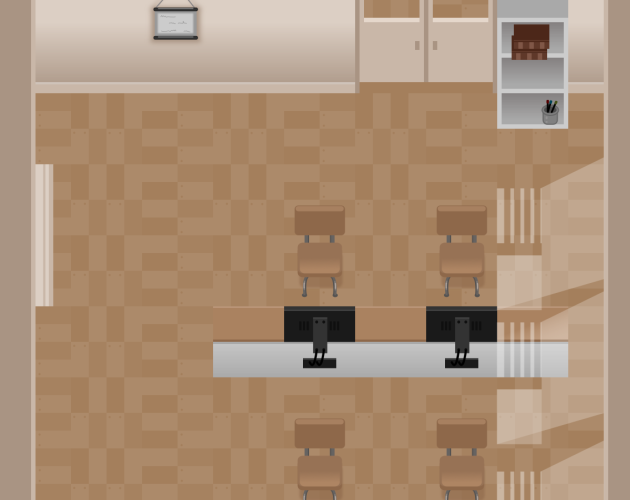
Identify the location of pencil pot. The width and height of the screenshot is (630, 500). (547, 119).